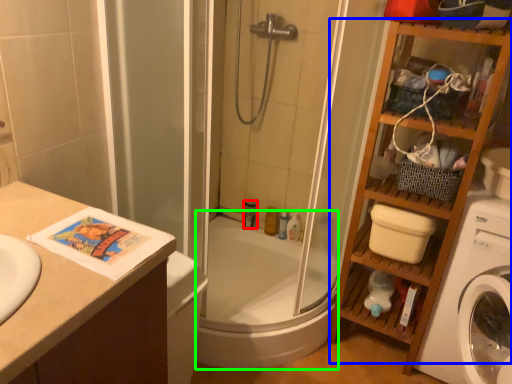
Question: Considering the real-world distances, which object is closest to toiletry (highlighted by a red box)? cabinet (highlighted by a blue box) or bath (highlighted by a green box).

Choices:
 (A) cabinet
 (B) bath

Answer: (B)